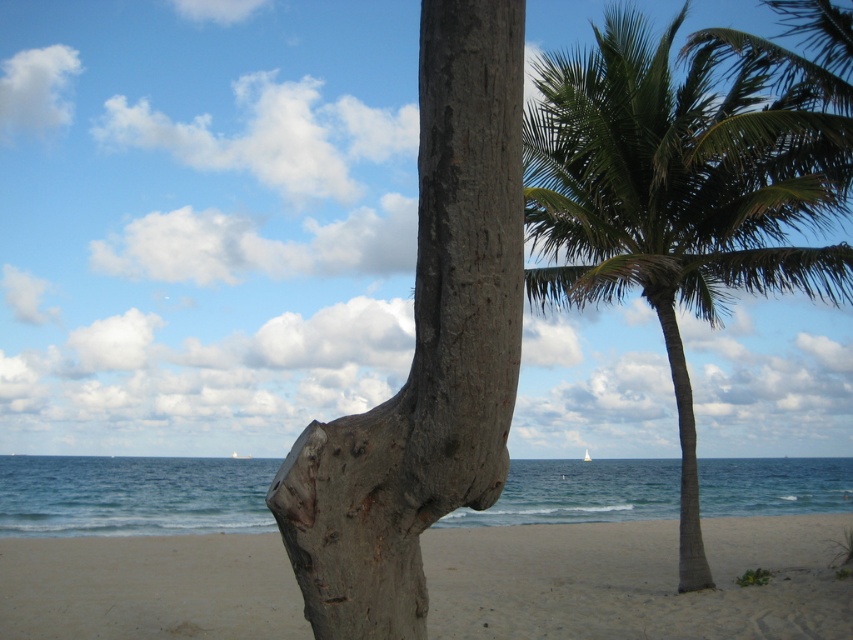
You are standing at the center of the beach scene. You see the gray rough bark tree trunk at center and the green leafy coconut tree at right. Which tree is closer to your right side?

The green leafy coconut tree at right is positioned on the right side of gray rough bark tree trunk at center, so it is closer to your right side.

You are standing on the beach and want to walk from the sandy beige at lower center to the green leafy coconut tree at right. Which direction should you head?

You should head to the right because the green leafy coconut tree at right is positioned on the right side of the sandy beige at lower center.